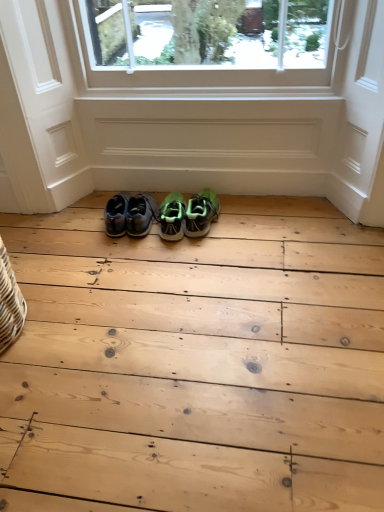
This screenshot has width=384, height=512. What do you see at coordinates (172, 217) in the screenshot?
I see `green matte sneakers at center, which is the second footwear in right-to-left order` at bounding box center [172, 217].

What is the approximate width of matte black sneakers at center, acting as the 3th footwear starting from the right?

13.20 inches.

The image size is (384, 512). Identify the location of green mesh sneakers at center, which is the third footwear in left-to-right order. (201, 213).

The image size is (384, 512). Describe the element at coordinates (201, 213) in the screenshot. I see `green mesh sneakers at center, which ranks as the 1th footwear in right-to-left order` at that location.

I want to click on green matte sneakers at center, which appears as the 2th footwear when viewed from the left, so click(x=172, y=217).

From a real-world perspective, which object rests below the other?

From a 3D spatial view, green matte sneakers at center, which is the second footwear in right-to-left order, is below.

Between point (182, 221) and point (188, 229), which one is positioned behind?

The point (188, 229) is behind.

Which is more to the left, green matte sneakers at center, which appears as the 2th footwear when viewed from the left, or green mesh sneakers at center, which ranks as the 1th footwear in right-to-left order?

green matte sneakers at center, which appears as the 2th footwear when viewed from the left, is more to the left.

How much distance is there between green matte sneakers at center, which appears as the 2th footwear when viewed from the left, and green mesh sneakers at center, which ranks as the 1th footwear in right-to-left order?

green matte sneakers at center, which appears as the 2th footwear when viewed from the left, is 7.14 centimeters from green mesh sneakers at center, which ranks as the 1th footwear in right-to-left order.

Is green matte sneakers at center, which appears as the 2th footwear when viewed from the left, facing away from matte black sneakers at center, acting as the 3th footwear starting from the right?

No, green matte sneakers at center, which appears as the 2th footwear when viewed from the left,'s orientation is not away from matte black sneakers at center, acting as the 3th footwear starting from the right.

In the scene shown: How much distance is there between green matte sneakers at center, which is the second footwear in right-to-left order, and matte black sneakers at center, acting as the 3th footwear starting from the right?

A distance of 3.33 inches exists between green matte sneakers at center, which is the second footwear in right-to-left order, and matte black sneakers at center, acting as the 3th footwear starting from the right.

Based on the photo, from a real-world perspective, is green matte sneakers at center, which is the second footwear in right-to-left order, physically below matte black sneakers at center, acting as the 3th footwear starting from the right?

Correct, in the physical world, green matte sneakers at center, which is the second footwear in right-to-left order, is lower than matte black sneakers at center, acting as the 3th footwear starting from the right.

I want to click on footwear that is the 2nd one when counting downward from the matte black sneakers at center, acting as the 3th footwear starting from the right (from the image's perspective), so pyautogui.click(x=172, y=217).

From a real-world perspective, which is physically above, matte black sneakers at center, acting as the 3th footwear starting from the right, or green matte sneakers at center, which is the second footwear in right-to-left order?

In real-world perspective, matte black sneakers at center, acting as the 3th footwear starting from the right, is above.

Is matte black sneakers at center, acting as the 1th footwear starting from the left, positioned with its back to green matte sneakers at center, which is the second footwear in right-to-left order?

matte black sneakers at center, acting as the 1th footwear starting from the left, is not turned away from green matte sneakers at center, which is the second footwear in right-to-left order.

Measure the distance from matte black sneakers at center, acting as the 1th footwear starting from the left, to green matte sneakers at center, which is the second footwear in right-to-left order.

8.45 centimeters.

Based on the photo, which of these two, matte black sneakers at center, acting as the 1th footwear starting from the left, or green mesh sneakers at center, which ranks as the 1th footwear in right-to-left order, is bigger?

With larger size is matte black sneakers at center, acting as the 1th footwear starting from the left.

Is matte black sneakers at center, acting as the 3th footwear starting from the right, positioned with its back to green mesh sneakers at center, which is the third footwear in left-to-right order?

matte black sneakers at center, acting as the 3th footwear starting from the right, does not have its back to green mesh sneakers at center, which is the third footwear in left-to-right order.

Consider the image. From a real-world perspective, who is located higher, matte black sneakers at center, acting as the 1th footwear starting from the left, or green mesh sneakers at center, which is the third footwear in left-to-right order?

matte black sneakers at center, acting as the 1th footwear starting from the left, is physically above.

From the picture: Considering the sizes of objects green mesh sneakers at center, which is the third footwear in left-to-right order, and green matte sneakers at center, which appears as the 2th footwear when viewed from the left, in the image provided, who is shorter, green mesh sneakers at center, which is the third footwear in left-to-right order, or green matte sneakers at center, which appears as the 2th footwear when viewed from the left,?

Standing shorter between the two is green mesh sneakers at center, which is the third footwear in left-to-right order.

In the image, is green mesh sneakers at center, which ranks as the 1th footwear in right-to-left order, positioned in front of or behind green matte sneakers at center, which is the second footwear in right-to-left order?

Visually, green mesh sneakers at center, which ranks as the 1th footwear in right-to-left order, is located in front of green matte sneakers at center, which is the second footwear in right-to-left order.

From the image's perspective, does green mesh sneakers at center, which is the third footwear in left-to-right order, appear higher than green matte sneakers at center, which is the second footwear in right-to-left order?

Yes, from the image's perspective, green mesh sneakers at center, which is the third footwear in left-to-right order, is on top of green matte sneakers at center, which is the second footwear in right-to-left order.

Between green mesh sneakers at center, which is the third footwear in left-to-right order, and green matte sneakers at center, which appears as the 2th footwear when viewed from the left, which one has smaller width?

Thinner between the two is green mesh sneakers at center, which is the third footwear in left-to-right order.

Which is correct: green mesh sneakers at center, which is the third footwear in left-to-right order, is inside matte black sneakers at center, acting as the 3th footwear starting from the right, or outside of it?

green mesh sneakers at center, which is the third footwear in left-to-right order, is located beyond the bounds of matte black sneakers at center, acting as the 3th footwear starting from the right.

How different are the orientations of green mesh sneakers at center, which is the third footwear in left-to-right order, and matte black sneakers at center, acting as the 3th footwear starting from the right, in degrees?

They differ by 7.41 degrees in their facing directions.

Which is more distant, (213, 198) or (132, 215)?

The point (213, 198) is farther from the camera.

Is green mesh sneakers at center, which ranks as the 1th footwear in right-to-left order, turned away from matte black sneakers at center, acting as the 1th footwear starting from the left?

No, matte black sneakers at center, acting as the 1th footwear starting from the left, is not at the back of green mesh sneakers at center, which ranks as the 1th footwear in right-to-left order.

The image size is (384, 512). In order to click on the 1st footwear above the green matte sneakers at center, which is the second footwear in right-to-left order (from the image's perspective) in this screenshot , I will do `click(201, 213)`.

Identify the location of footwear that is the 1st object to the right of the matte black sneakers at center, acting as the 3th footwear starting from the right, starting at the anchor. Image resolution: width=384 pixels, height=512 pixels. (172, 217).

When comparing their distances from green mesh sneakers at center, which ranks as the 1th footwear in right-to-left order, does green matte sneakers at center, which appears as the 2th footwear when viewed from the left, or matte black sneakers at center, acting as the 3th footwear starting from the right, seem closer?

The object closer to green mesh sneakers at center, which ranks as the 1th footwear in right-to-left order, is green matte sneakers at center, which appears as the 2th footwear when viewed from the left.

Which object lies further to the anchor point green mesh sneakers at center, which ranks as the 1th footwear in right-to-left order, matte black sneakers at center, acting as the 3th footwear starting from the right, or green matte sneakers at center, which is the second footwear in right-to-left order?

matte black sneakers at center, acting as the 3th footwear starting from the right, is further to green mesh sneakers at center, which ranks as the 1th footwear in right-to-left order.

Estimate the real-world distances between objects in this image. Which object is closer to green matte sneakers at center, which is the second footwear in right-to-left order, matte black sneakers at center, acting as the 3th footwear starting from the right, or green mesh sneakers at center, which is the third footwear in left-to-right order?

The object closer to green matte sneakers at center, which is the second footwear in right-to-left order, is green mesh sneakers at center, which is the third footwear in left-to-right order.

Which object lies nearer to the anchor point matte black sneakers at center, acting as the 1th footwear starting from the left, green mesh sneakers at center, which is the third footwear in left-to-right order, or green matte sneakers at center, which appears as the 2th footwear when viewed from the left?

Among the two, green matte sneakers at center, which appears as the 2th footwear when viewed from the left, is located nearer to matte black sneakers at center, acting as the 1th footwear starting from the left.

Based on their spatial positions, is green matte sneakers at center, which is the second footwear in right-to-left order, or green mesh sneakers at center, which is the third footwear in left-to-right order, closer to matte black sneakers at center, acting as the 3th footwear starting from the right?

Based on the image, green matte sneakers at center, which is the second footwear in right-to-left order, appears to be nearer to matte black sneakers at center, acting as the 3th footwear starting from the right.

Considering their positions, is green mesh sneakers at center, which is the third footwear in left-to-right order, positioned further to green matte sneakers at center, which is the second footwear in right-to-left order, than matte black sneakers at center, acting as the 3th footwear starting from the right?

matte black sneakers at center, acting as the 3th footwear starting from the right, lies further to green matte sneakers at center, which is the second footwear in right-to-left order, than the other object.

The image size is (384, 512). Identify the location of footwear located between matte black sneakers at center, acting as the 1th footwear starting from the left, and green mesh sneakers at center, which ranks as the 1th footwear in right-to-left order, in the left-right direction. (172, 217).